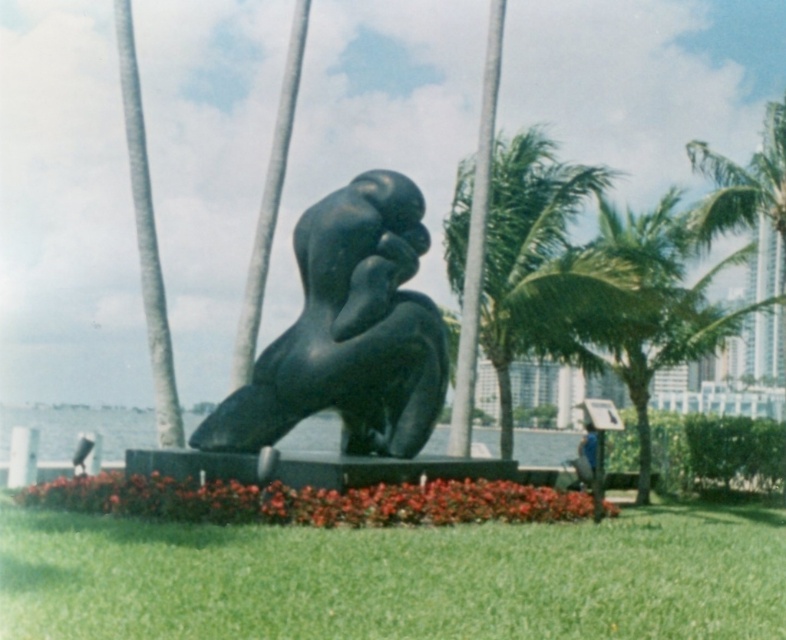
From the picture: You are a landscape architect designing a garden layout. You need to place a new bench between the green leafy palm tree at center and the smooth gray tree at center. Which tree should the bench be closer to if you want it to be near the wider tree?

The bench should be placed closer to the green leafy palm tree at center because its width surpasses that of the smooth gray tree at center.

You are a photographer standing at the camera position. You want to take a photo of the sculpture and the green leafy palm tree at center. Can you fit both in the frame if your camera has a standard 50mm lens?

The green leafy palm tree at center is 13.35 meters away from camera. With a standard 50mm lens, the field of view is approximately 46 degrees. Since the palm tree is positioned at the center and the sculpture is also within the same scene, both should fit within the frame as they are part of the same composition.